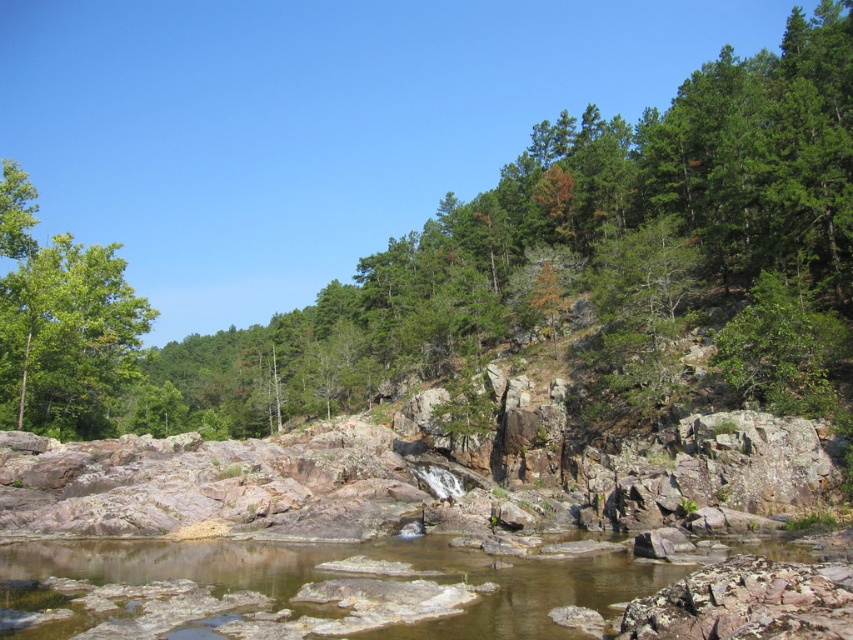
Question: Is green leafy tree at upper center behind green leafy tree at left?

Choices:
 (A) yes
 (B) no

Answer: (B)

Question: Which point appears farthest from the camera in this image?

Choices:
 (A) (111, 378)
 (B) (4, 412)

Answer: (A)

Question: Can you confirm if green leafy tree at upper center is bigger than green leafy tree at left?

Choices:
 (A) yes
 (B) no

Answer: (A)

Question: In this image, where is green leafy tree at upper center located relative to green leafy tree at left?

Choices:
 (A) right
 (B) left

Answer: (A)

Question: Which point is farther to the camera?

Choices:
 (A) (837, 12)
 (B) (28, 426)

Answer: (A)